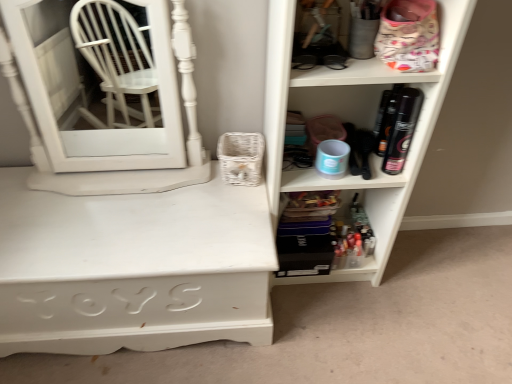
Find the location of a particular element. unoccupied region to the right of matte white shelf at right, which ranks as the 2th shelf in bottom-to-top order is located at coordinates (420, 275).